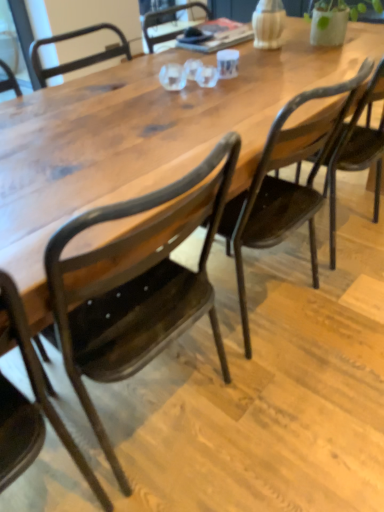
Question: Is matte dark wood chair at center, which appears as the 1th chair when viewed from the right, in front of or behind matte black chair at center, which appears as the second chair when viewed from the left, in the image?

Choices:
 (A) behind
 (B) front

Answer: (A)

Question: Is point (269, 187) closer or farther from the camera than point (185, 317)?

Choices:
 (A) farther
 (B) closer

Answer: (A)

Question: Considering the real-world distances, which object is farthest from the metallic dark brown chair at lower left, which appears as the 3th chair when viewed from the right?

Choices:
 (A) matte dark wood chair at center, which ranks as the third chair in left-to-right order
 (B) matte black chair at center, which appears as the second chair when viewed from the left

Answer: (A)

Question: Which object is positioned farthest from the matte black chair at center, which is the second chair from right to left?

Choices:
 (A) matte dark wood chair at center, which ranks as the third chair in left-to-right order
 (B) metallic dark brown chair at lower left, which appears as the 3th chair when viewed from the right

Answer: (A)